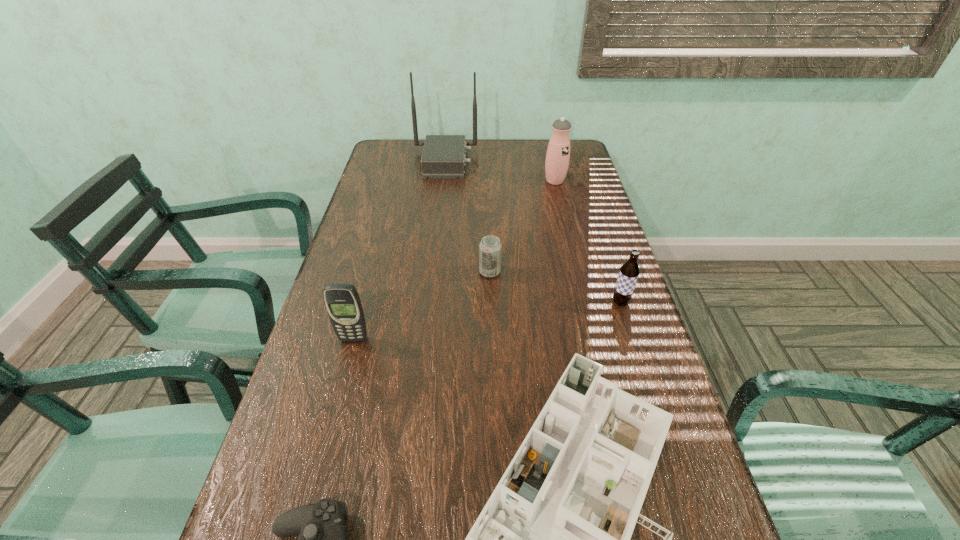
At what (x,y) coordinates should I click in order to perform the action: click on object located at the far edge. Please return your answer as a coordinate pair (x, y). Looking at the image, I should click on (443, 157).

What are the coordinates of `router that is at the left edge` in the screenshot? It's located at (443, 157).

Locate an element on the screen. cellular telephone positioned at the left edge is located at coordinates (342, 301).

Identify the location of thermos bottle located at the right edge. The image size is (960, 540). (558, 152).

Locate an element on the screen. The image size is (960, 540). root beer at the right edge is located at coordinates (629, 271).

Where is `object that is at the far left corner`? object that is at the far left corner is located at coordinates (443, 157).

The image size is (960, 540). Find the location of `vacant space at the far edge of the desktop`. vacant space at the far edge of the desktop is located at coordinates pos(482,147).

The width and height of the screenshot is (960, 540). I want to click on vacant region at the left edge of the desktop, so tap(344, 271).

You are a GUI agent. You are given a task and a screenshot of the screen. Output one action in this format:
    pyautogui.click(x=<x>, y=<y>)
    Task: Click on the vacant space at the right edge
    This screenshot has height=540, width=960.
    Given the screenshot: What is the action you would take?
    pyautogui.click(x=636, y=358)

The image size is (960, 540). What are the coordinates of `free space between the soda can and the fourth farthest object` in the screenshot? It's located at (555, 287).